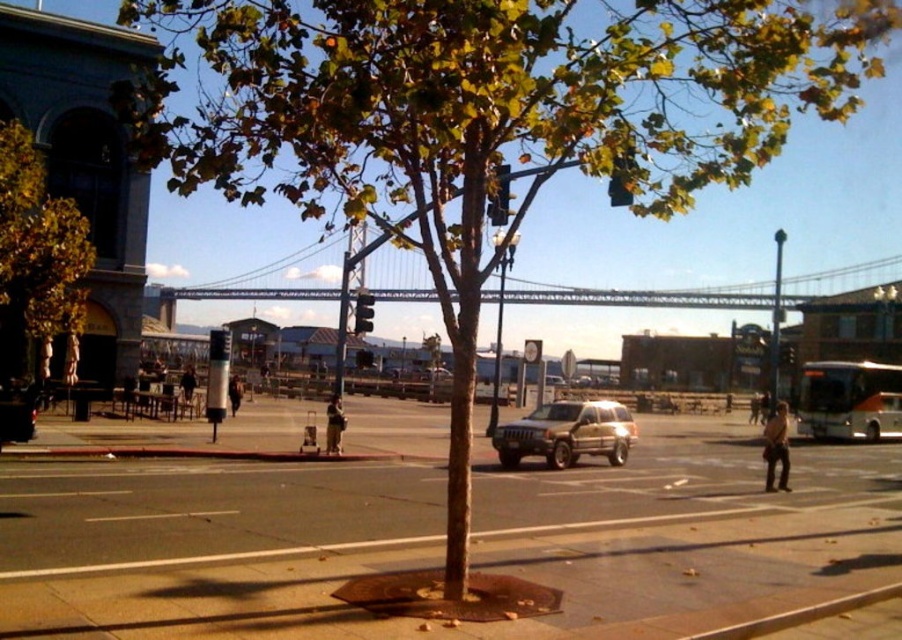
Does brown asphalt pavement at center appear over metallic gray suspension bridge at center?

Incorrect, brown asphalt pavement at center is not positioned above metallic gray suspension bridge at center.

Is the position of brown asphalt pavement at center less distant than that of metallic gray suspension bridge at center?

Yes, brown asphalt pavement at center is in front of metallic gray suspension bridge at center.

Between point (19, 634) and point (264, 289), which one is positioned behind?

Point (264, 289)

Image resolution: width=902 pixels, height=640 pixels. Identify the location of brown asphalt pavement at center. (440, 538).

Consider the image. Is metallic gray suspension bridge at center below gold metallic suv at center?

Incorrect, metallic gray suspension bridge at center is not positioned below gold metallic suv at center.

Between point (199, 294) and point (597, 416), which one is positioned behind?

Point (199, 294)

What are the coordinates of `metallic gray suspension bridge at center` in the screenshot? It's located at (643, 296).

Between green leafy tree at left and metallic gray suspension bridge at center, which one is positioned higher?

metallic gray suspension bridge at center

Does green leafy tree at left have a lesser width compared to metallic gray suspension bridge at center?

Yes, green leafy tree at left is thinner than metallic gray suspension bridge at center.

I want to click on green leafy tree at left, so click(37, 250).

You are a GUI agent. You are given a task and a screenshot of the screen. Output one action in this format:
    pyautogui.click(x=<x>, y=<y>)
    Task: Click on the green leafy tree at left
    Image resolution: width=902 pixels, height=640 pixels.
    Given the screenshot: What is the action you would take?
    pyautogui.click(x=37, y=250)